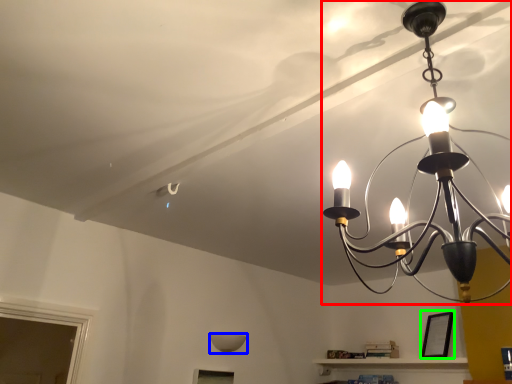
Question: Which object is positioned farthest from lamp (highlighted by a red box)? Select from lamp (highlighted by a blue box) and picture frame (highlighted by a green box).

Choices:
 (A) lamp
 (B) picture frame

Answer: (A)